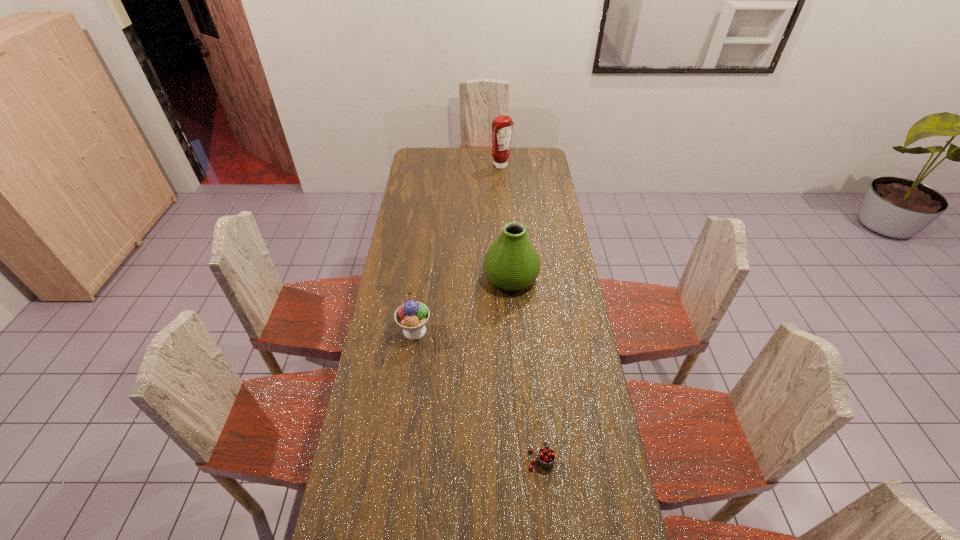
Where is `object that ranks as the second closest to the farthest object`? object that ranks as the second closest to the farthest object is located at coordinates (412, 316).

Identify the location of vacant space that satisfies the following two spatial constraints: 1. on the back side of the condiment; 2. on the left side of the leftmost object. (437, 166).

Image resolution: width=960 pixels, height=540 pixels. What are the coordinates of `blank area in the image that satisfies the following two spatial constraints: 1. on the front side of the second farthest object; 2. on the left side of the condiment` in the screenshot? It's located at (508, 277).